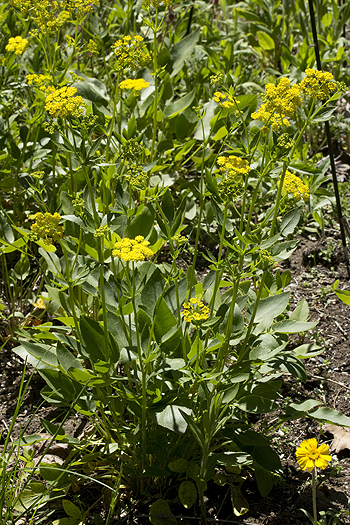
The image size is (350, 525). In order to click on background plants in this screenshot , I will do `click(44, 52)`, `click(191, 12)`, `click(276, 29)`.